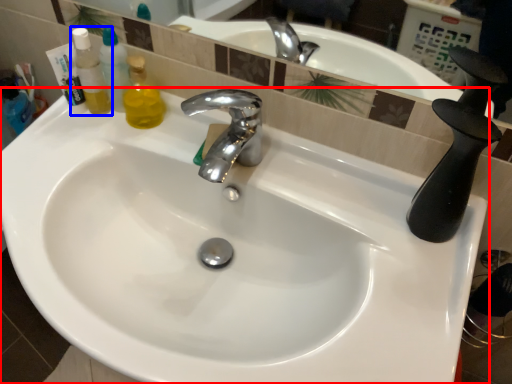
Question: Among these objects, which one is farthest to the camera, sink (highlighted by a red box) or mouthwash (highlighted by a blue box)?

Choices:
 (A) sink
 (B) mouthwash

Answer: (B)